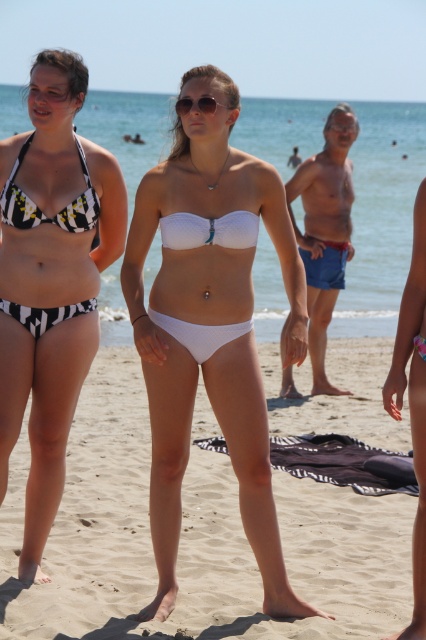
Is white fabric bikini bottom at center shorter than black and white printed bikini at left?

Yes.

Does white fabric bikini bottom at center come behind black and white printed bikini at left?

No, white fabric bikini bottom at center is in front of black and white printed bikini at left.

Identify the location of white fabric bikini bottom at center. (193, 538).

Is white matte bikini bottom at lower right thinner than sunglasses at center?

Correct, white matte bikini bottom at lower right's width is less than sunglasses at center's.

Is white matte bikini bottom at lower right shorter than sunglasses at center?

In fact, white matte bikini bottom at lower right may be taller than sunglasses at center.

Between point (423, 532) and point (176, 99), which one is positioned in front?

Point (423, 532) is in front.

Locate an element on the screen. This screenshot has height=640, width=426. white matte bikini bottom at lower right is located at coordinates (412, 401).

Which is above, black and white printed bikini at left or black and white striped bikini top at left?

black and white striped bikini top at left is higher up.

Is black and white printed bikini at left bigger than black and white striped bikini top at left?

Indeed, black and white printed bikini at left has a larger size compared to black and white striped bikini top at left.

Does point (71, 113) come in front of point (80, 228)?

That is True.

Find the location of a particular element. The width and height of the screenshot is (426, 640). black and white printed bikini at left is located at coordinates pyautogui.click(x=51, y=280).